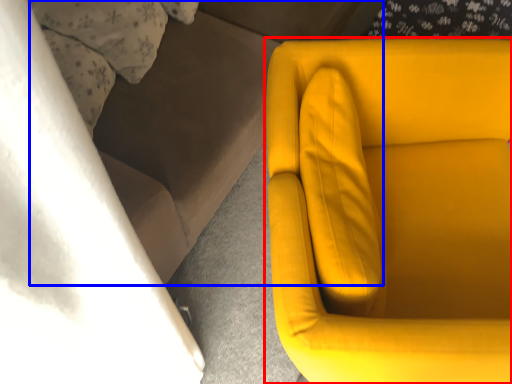
Question: Among these objects, which one is nearest to the camera, chair (highlighted by a red box) or couch (highlighted by a blue box)?

Choices:
 (A) chair
 (B) couch

Answer: (A)